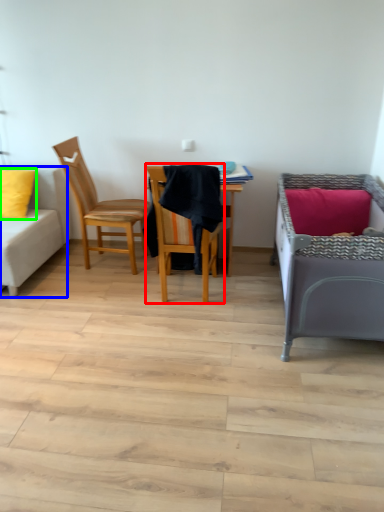
Question: Based on their relative distances, which object is farther from chair (highlighted by a red box)? Choose from studio couch (highlighted by a blue box) and pillow (highlighted by a green box).

Choices:
 (A) studio couch
 (B) pillow

Answer: (B)